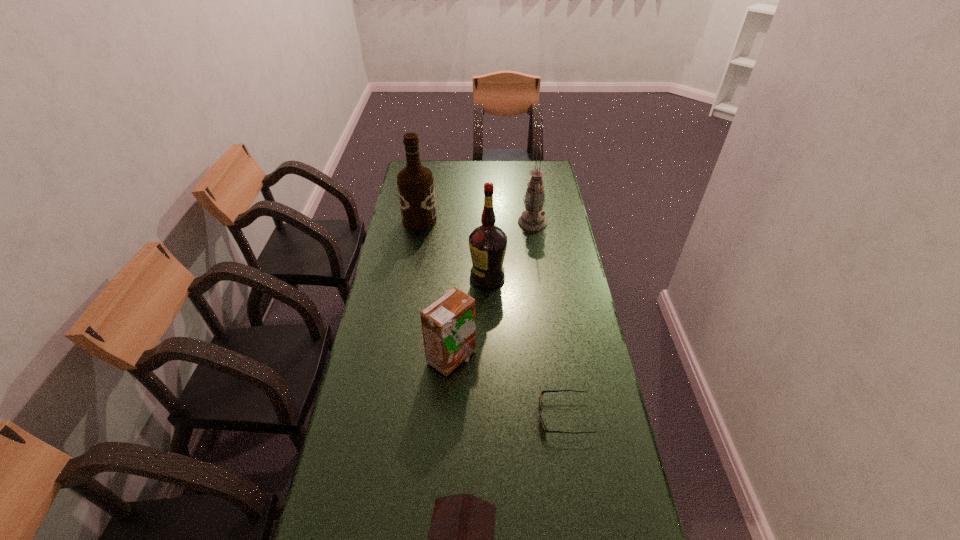
Identify the location of the fourth nearest object. The width and height of the screenshot is (960, 540). (487, 243).

Identify the location of the right alcohol. [487, 243].

Find the location of a particular element. The width and height of the screenshot is (960, 540). the left alcohol is located at coordinates (415, 183).

Locate an element on the screen. Image resolution: width=960 pixels, height=540 pixels. the farther alcohol is located at coordinates (415, 183).

You are a GUI agent. You are given a task and a screenshot of the screen. Output one action in this format:
    pyautogui.click(x=<x>, y=<y>)
    Task: Click on the oil lamp
    Image resolution: width=960 pixels, height=540 pixels.
    Given the screenshot: What is the action you would take?
    pyautogui.click(x=532, y=219)

The image size is (960, 540). Find the location of `the fourth farthest object`. the fourth farthest object is located at coordinates (448, 324).

The image size is (960, 540). I want to click on carton, so click(x=448, y=324).

The image size is (960, 540). Find the location of `the fifth farthest object`. the fifth farthest object is located at coordinates (542, 392).

Image resolution: width=960 pixels, height=540 pixels. Find the location of `sunglasses`. sunglasses is located at coordinates (542, 392).

Locate an element on the screen. free region located on the label of the nearer alcohol is located at coordinates (417, 277).